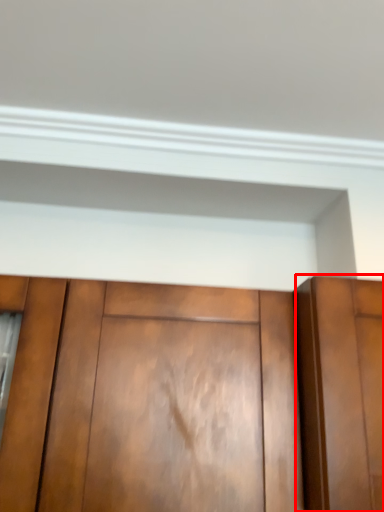
Question: From the image's perspective, where is door (annotated by the red box) located in relation to cupboard in the image?

Choices:
 (A) below
 (B) above

Answer: (B)